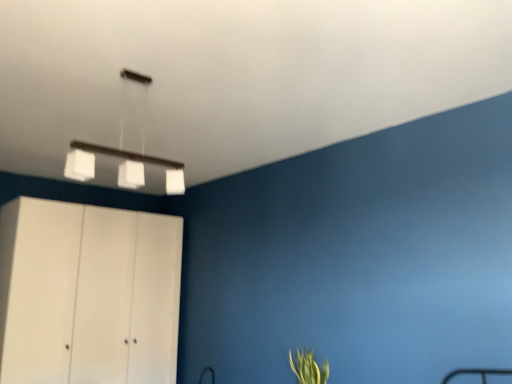
Question: In terms of height, does white matte rectangular light fixture at upper center look taller or shorter compared to green leafy plant at lower right?

Choices:
 (A) short
 (B) tall

Answer: (B)

Question: From a real-world perspective, is white matte rectangular light fixture at upper center positioned above or below green leafy plant at lower right?

Choices:
 (A) below
 (B) above

Answer: (B)

Question: Based on their relative distances, which object is farther from the white matte rectangular light fixture at upper center?

Choices:
 (A) white matte cabinet at left
 (B) green leafy plant at lower right

Answer: (B)

Question: Which of these objects is positioned closest to the white matte cabinet at left?

Choices:
 (A) green leafy plant at lower right
 (B) white matte rectangular light fixture at upper center

Answer: (B)